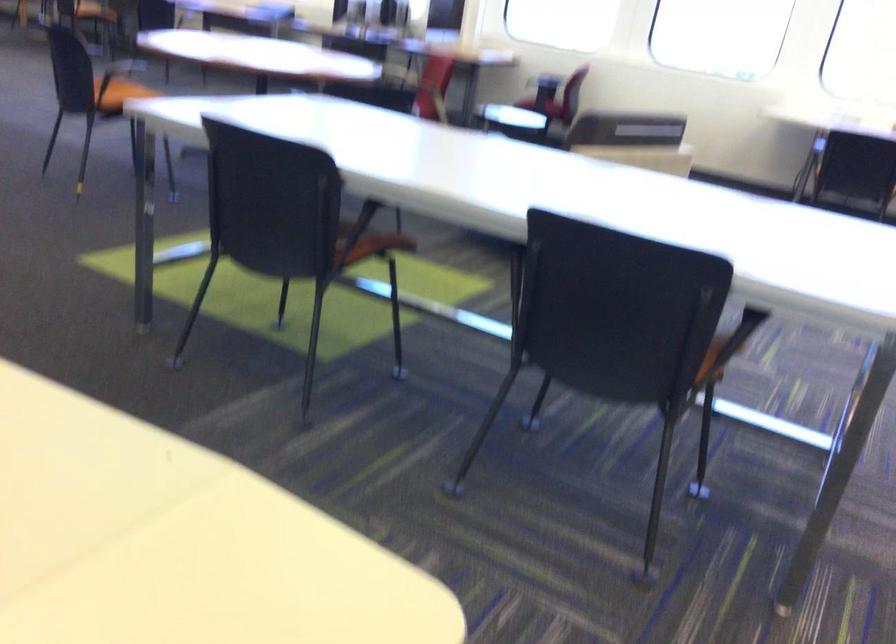
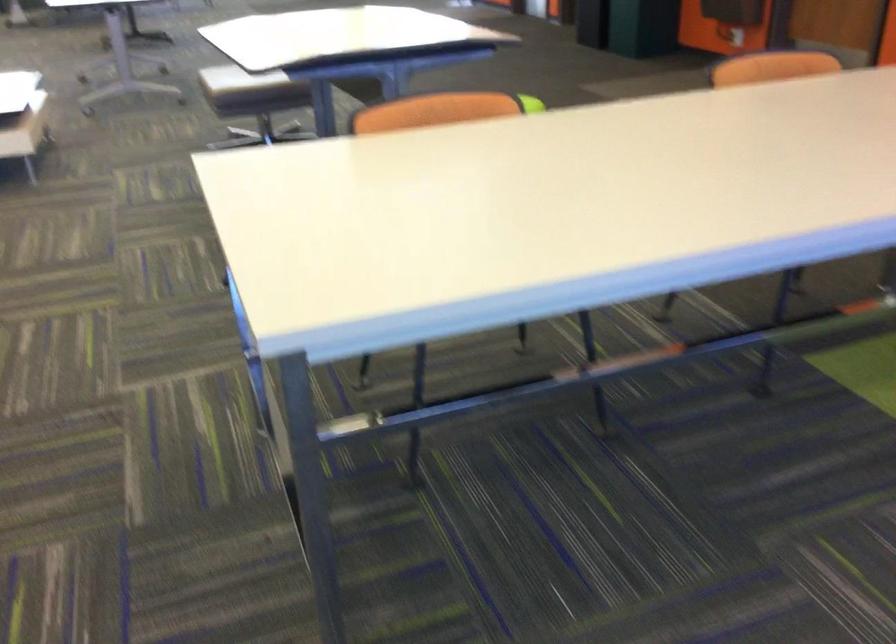
Where in the second image is the point corresponding to the point at 729,218 from the first image?

(492, 189)